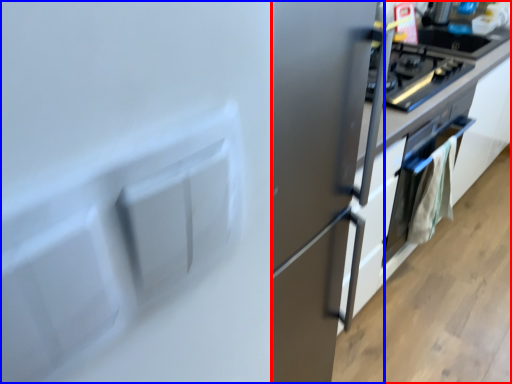
Question: Which object appears farthest to the camera in this image, cabinetry (highlighted by a red box) or fridge (highlighted by a blue box)?

Choices:
 (A) cabinetry
 (B) fridge

Answer: (A)